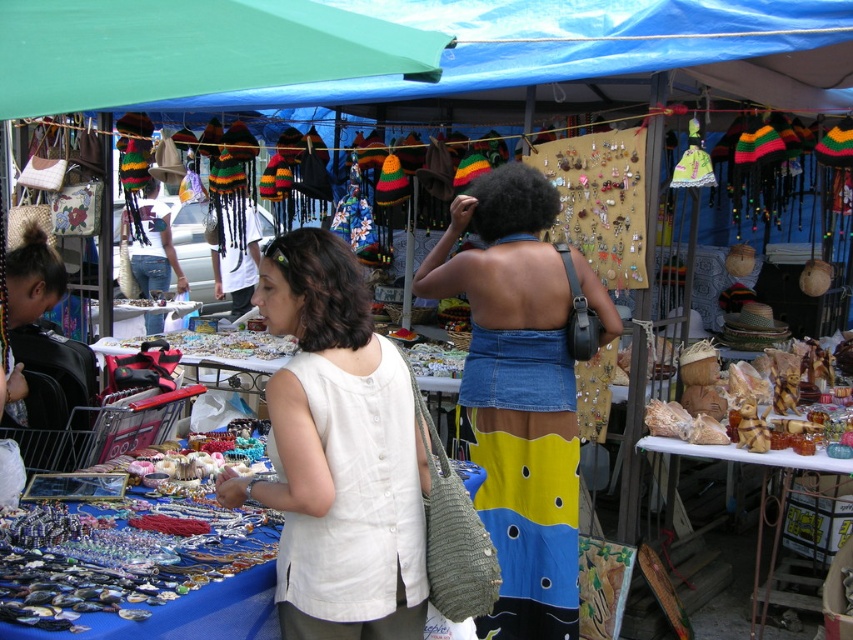
Is white linen blouse at center taller than green fabric canopy at upper left?

Correct, white linen blouse at center is much taller as green fabric canopy at upper left.

Who is more forward, [334,449] or [194,10]?

Point [194,10] is in front.

At what (x,y) coordinates should I click in order to perform the action: click on white linen blouse at center. Please return your answer as a coordinate pair (x, y). The image size is (853, 640). Looking at the image, I should click on (338, 452).

Is denim skirt at center positioned behind green fabric canopy at upper left?

Yes.

Measure the distance between denim skirt at center and camera.

The distance of denim skirt at center from camera is 10.47 feet.

What are the coordinates of `denim skirt at center` in the screenshot? It's located at (517, 394).

Is point (404, 385) farther from viewer compared to point (474, 253)?

No.

Which is in front, point (361, 556) or point (503, 396)?

Positioned in front is point (361, 556).

Image resolution: width=853 pixels, height=640 pixels. Describe the element at coordinates (338, 452) in the screenshot. I see `white linen blouse at center` at that location.

Locate an element on the screen. white linen blouse at center is located at coordinates (338, 452).